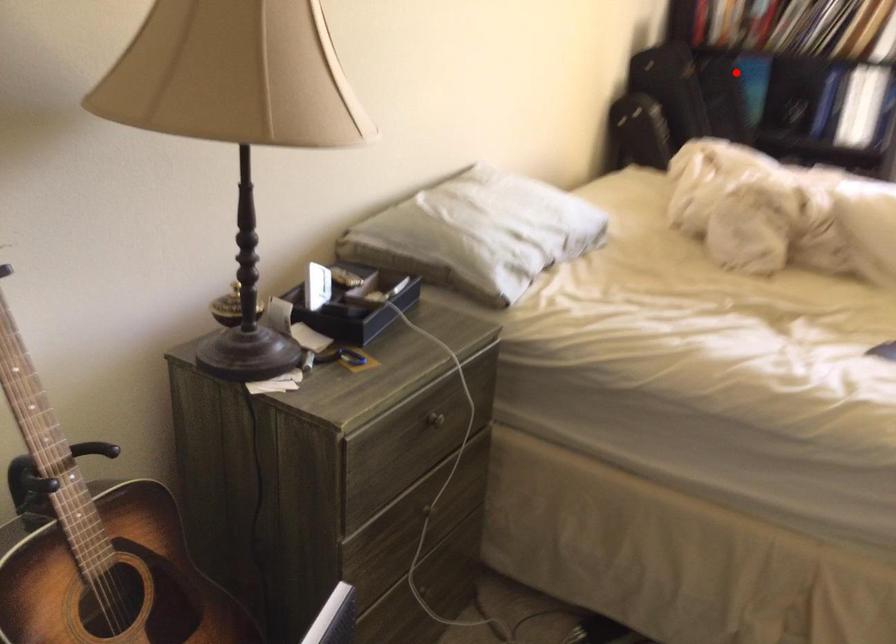
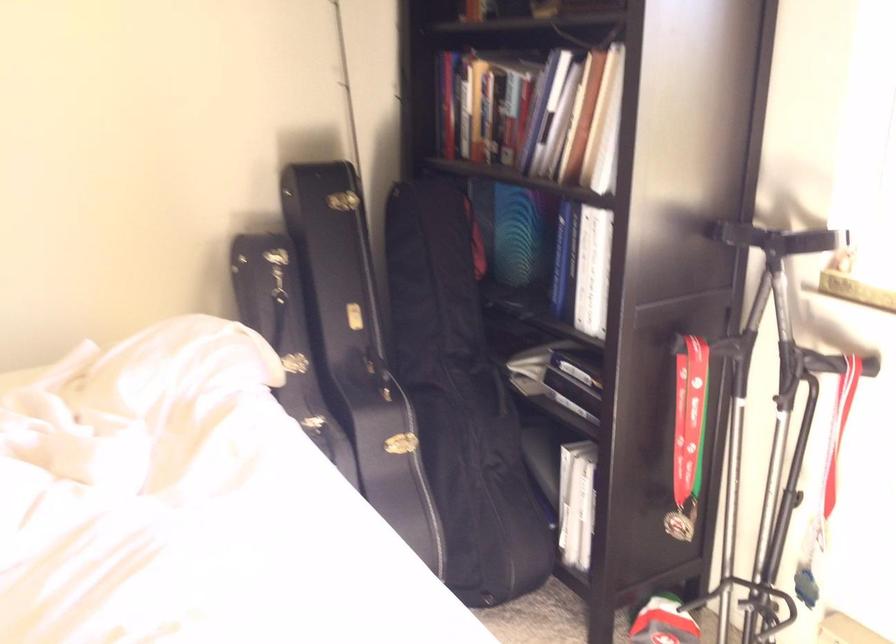
Find the pixel in the second image that matches the highlighted location in the first image.

(519, 236)